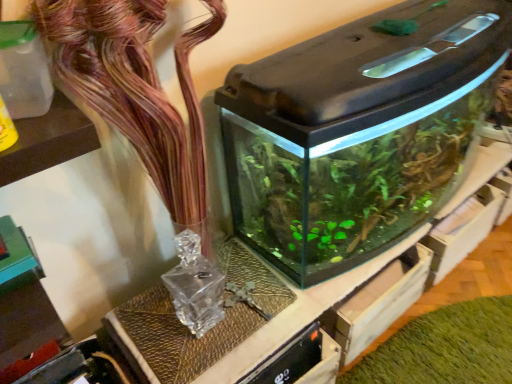
Question: Is green matte plant at lower right further to the viewer compared to translucent glass vase at upper center?

Choices:
 (A) no
 (B) yes

Answer: (B)

Question: Is translucent glass vase at upper center inside green matte plant at lower right?

Choices:
 (A) yes
 (B) no

Answer: (B)

Question: Can you confirm if green matte plant at lower right is bigger than translucent glass vase at upper center?

Choices:
 (A) yes
 (B) no

Answer: (B)

Question: Can you confirm if green matte plant at lower right is positioned to the right of translucent glass vase at upper center?

Choices:
 (A) no
 (B) yes

Answer: (B)

Question: Does green matte plant at lower right have a smaller size compared to translucent glass vase at upper center?

Choices:
 (A) yes
 (B) no

Answer: (A)

Question: Looking at their shapes, would you say green matte plant at lower right is wider or thinner than transparent glass water tank at center?

Choices:
 (A) wide
 (B) thin

Answer: (A)

Question: In the image, is green matte plant at lower right positioned in front of or behind transparent glass water tank at center?

Choices:
 (A) front
 (B) behind

Answer: (B)

Question: Would you say green matte plant at lower right is to the left or to the right of transparent glass water tank at center in the picture?

Choices:
 (A) left
 (B) right

Answer: (B)

Question: From their relative heights in the image, would you say green matte plant at lower right is taller or shorter than transparent glass water tank at center?

Choices:
 (A) tall
 (B) short

Answer: (B)

Question: Considering the relative positions of transparent glass water tank at center and translucent glass vase at upper center in the image provided, is transparent glass water tank at center to the left or to the right of translucent glass vase at upper center?

Choices:
 (A) right
 (B) left

Answer: (A)

Question: In terms of width, does transparent glass water tank at center look wider or thinner when compared to translucent glass vase at upper center?

Choices:
 (A) wide
 (B) thin

Answer: (A)

Question: Does point (266, 84) appear closer or farther from the camera than point (214, 13)?

Choices:
 (A) closer
 (B) farther

Answer: (A)

Question: Is transparent glass water tank at center bigger or smaller than translucent glass vase at upper center?

Choices:
 (A) big
 (B) small

Answer: (A)

Question: From the image's perspective, is transparent glass water tank at center located above or below green matte plant at lower right?

Choices:
 (A) above
 (B) below

Answer: (A)

Question: In terms of width, does transparent glass water tank at center look wider or thinner when compared to green matte plant at lower right?

Choices:
 (A) wide
 (B) thin

Answer: (B)